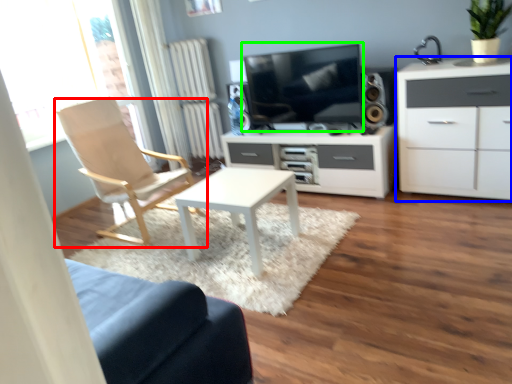
Question: Which object is the farthest from chair (highlighted by a red box)? Choose among these: cabinetry (highlighted by a blue box) or television (highlighted by a green box).

Choices:
 (A) cabinetry
 (B) television

Answer: (A)